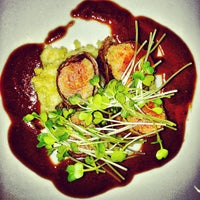
Where is `gaps in sauce coverage on plate`? The width and height of the screenshot is (200, 200). gaps in sauce coverage on plate is located at coordinates pos(83,34), pos(158,80), pos(52,157), pos(137,148).